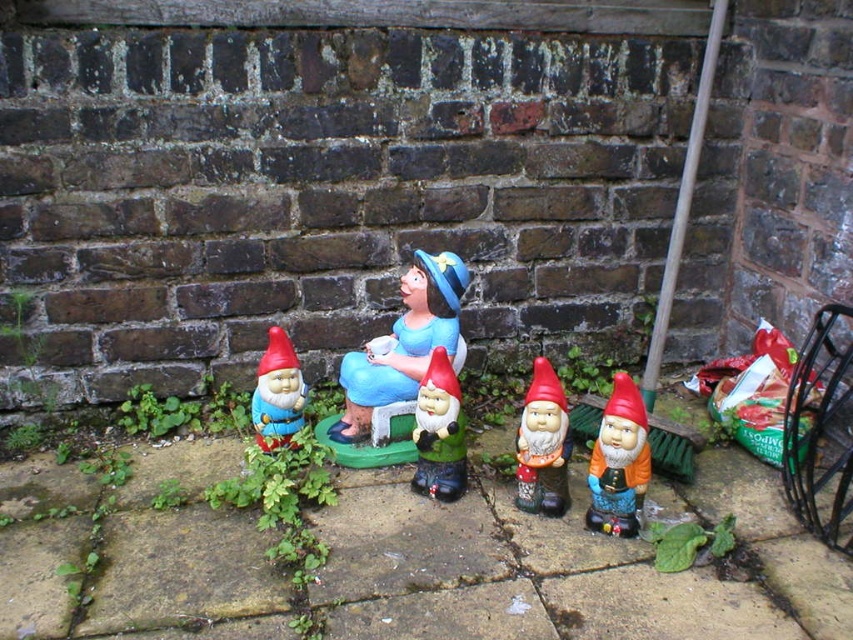
You are a child who wants to place a new gnome figurine in the garden scene. You have two options to choose from. The first option is the matte plastic gnome at center, and the second option is the matte plastic gnome at left. Which gnome should you choose if you want a bigger gnome for your collection?

The matte plastic gnome at center is larger in size than the matte plastic gnome at left, so you should choose the matte plastic gnome at center for a bigger gnome.

Consider the image. You are designing a display case for the orange matte gnome at right and the matte plastic gnome at left. Since the case has a width limit of 10 cm, which gnome will fit better in the display case?

The orange matte gnome at right will fit better in the display case because its width is less than the matte plastic gnome at left, making it more suitable for the 10 cm width limit.